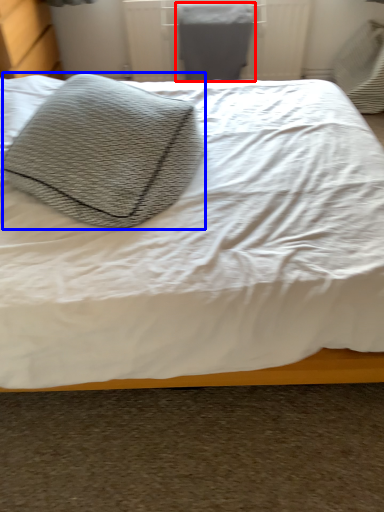
Question: Which object is closer to the camera taking this photo, gray (highlighted by a red box) or throw pillow (highlighted by a blue box)?

Choices:
 (A) gray
 (B) throw pillow

Answer: (B)